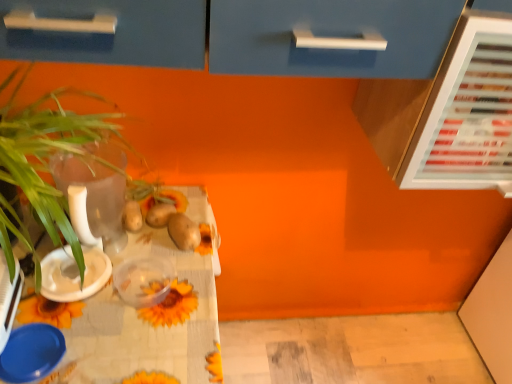
Describe the element at coordinates (174, 198) in the screenshot. This screenshot has width=512, height=384. I see `yellow matte flower at center` at that location.

This screenshot has height=384, width=512. Describe the element at coordinates (95, 196) in the screenshot. I see `transparent glass vase at left` at that location.

How much space does blue plastic lid at lower left, which is the 1th tableware in bottom-to-top order, occupy vertically?

blue plastic lid at lower left, which is the 1th tableware in bottom-to-top order, is 0.75 inches in height.

Identify the location of translucent plastic container at center, arranged as the 2th tableware when ordered from the bottom. The image size is (512, 384). (144, 280).

Find the location of `white plastic bowl at left, which is counted as the 3th tableware, starting from the bottom`. white plastic bowl at left, which is counted as the 3th tableware, starting from the bottom is located at coordinates (x=74, y=274).

Measure the distance between point (67,265) and camera.

The depth of point (67,265) is 36.65 inches.

Where is `yellow matte flower at center`? Image resolution: width=512 pixels, height=384 pixels. yellow matte flower at center is located at coordinates (174, 198).

Does green leafy plant at left turn towards translucent plastic container at center, arranged as the 2th tableware when ordered from the bottom?

No, green leafy plant at left is not facing towards translucent plastic container at center, arranged as the 2th tableware when ordered from the bottom.

Can you tell me how much green leafy plant at left and translucent plastic container at center, which is the second tableware from top to bottom, differ in facing direction?

There is a 4.38-degree angle between the facing directions of green leafy plant at left and translucent plastic container at center, which is the second tableware from top to bottom.

From a real-world perspective, starting from the green leafy plant at left, which tableware is the 2nd one below it? Please provide its 2D coordinates.

[(144, 280)]

Is point (1, 131) closer or farther from the camera than point (121, 281)?

Point (1, 131).

The image size is (512, 384). In order to click on tableware on the right of green leafy plant at left in this screenshot , I will do `click(144, 280)`.

Considering the sizes of objects translucent plastic container at center, which is the second tableware from top to bottom, and green leafy plant at left in the image provided, who is taller, translucent plastic container at center, which is the second tableware from top to bottom, or green leafy plant at left?

green leafy plant at left is taller.

From a real-world perspective, is translucent plastic container at center, arranged as the 2th tableware when ordered from the bottom, above or below green leafy plant at left?

translucent plastic container at center, arranged as the 2th tableware when ordered from the bottom, is situated lower than green leafy plant at left in the real world.

Who is bigger, green leafy plant at left or blue plastic bowl at lower left?

Bigger between the two is green leafy plant at left.

From the image's perspective, is green leafy plant at left above or below blue plastic bowl at lower left?

Clearly, from the image's perspective, green leafy plant at left is above blue plastic bowl at lower left.

Looking at this image, from a real-world perspective, is green leafy plant at left below blue plastic bowl at lower left?

No.

Could you tell me if yellow matte flower at center is facing translucent plastic container at center, arranged as the 2th tableware when ordered from the bottom?

No, yellow matte flower at center is not oriented towards translucent plastic container at center, arranged as the 2th tableware when ordered from the bottom.

Is yellow matte flower at center bigger than translucent plastic container at center, arranged as the 2th tableware when ordered from the bottom?

Incorrect, yellow matte flower at center is not larger than translucent plastic container at center, arranged as the 2th tableware when ordered from the bottom.

In the image, is yellow matte flower at center positioned in front of or behind translucent plastic container at center, arranged as the 2th tableware when ordered from the bottom?

Clearly, yellow matte flower at center is behind translucent plastic container at center, arranged as the 2th tableware when ordered from the bottom.

Based on the photo, from the image's perspective, is yellow matte flower at center located beneath translucent plastic container at center, which is the second tableware from top to bottom?

No.

Would you say yellow matte flower at center is outside sunflower-patterned tablecloth at lower left?

Indeed, yellow matte flower at center is completely outside sunflower-patterned tablecloth at lower left.

Would you consider yellow matte flower at center to be distant from sunflower-patterned tablecloth at lower left?

They are positioned close to each other.

From a real-world perspective, which object rests below the other?

In real-world perspective, sunflower-patterned tablecloth at lower left is lower.

Is green leafy plant at left far from transparent glass vase at left?

No, green leafy plant at left is not far away from transparent glass vase at left.

Is green leafy plant at left facing away from transparent glass vase at left?

That's right, green leafy plant at left is facing away from transparent glass vase at left.

Considering the points (81, 94) and (56, 178), which point is in front, point (81, 94) or point (56, 178)?

Positioned in front is point (81, 94).

Consider the image. Is translucent plastic container at center, which is the second tableware from top to bottom, taller than blue plastic lid at lower left, positioned as the 3th tableware in top-to-bottom order?

In fact, translucent plastic container at center, which is the second tableware from top to bottom, may be shorter than blue plastic lid at lower left, positioned as the 3th tableware in top-to-bottom order.

From a real-world perspective, which is physically above, translucent plastic container at center, arranged as the 2th tableware when ordered from the bottom, or blue plastic lid at lower left, positioned as the 3th tableware in top-to-bottom order?

translucent plastic container at center, arranged as the 2th tableware when ordered from the bottom.

Between translucent plastic container at center, arranged as the 2th tableware when ordered from the bottom, and blue plastic lid at lower left, which is the 1th tableware in bottom-to-top order, which one appears on the left side from the viewer's perspective?

From the viewer's perspective, blue plastic lid at lower left, which is the 1th tableware in bottom-to-top order, appears more on the left side.

At what (x,y) coordinates should I click in order to perform the action: click on tableware that is the 2nd object located below the green leafy plant at left (from the image's perspective). Please return your answer as a coordinate pair (x, y). Looking at the image, I should click on tap(144, 280).

What are the coordinates of `the 3rd tableware behind the green leafy plant at left, counting from the anchor's position` in the screenshot? It's located at (144, 280).

From the image, which object appears to be nearer to white plastic bowl at left, the first tableware from the top, blue plastic lid at lower left, positioned as the 3th tableware in top-to-bottom order, or sunflower-patterned tablecloth at lower left?

Based on the image, blue plastic lid at lower left, positioned as the 3th tableware in top-to-bottom order, appears to be nearer to white plastic bowl at left, the first tableware from the top.

When comparing their distances from translucent plastic container at center, which is the second tableware from top to bottom, does blue plastic lid at lower left, positioned as the 3th tableware in top-to-bottom order, or green leafy plant at left seem further?

green leafy plant at left is further to translucent plastic container at center, which is the second tableware from top to bottom.

Estimate the real-world distances between objects in this image. Which object is closer to green leafy plant at left, blue plastic lid at lower left, which is the 1th tableware in bottom-to-top order, or sunflower-patterned tablecloth at lower left?

sunflower-patterned tablecloth at lower left.

Which object lies nearer to the anchor point sunflower-patterned tablecloth at lower left, green leafy plant at left or yellow matte flower at center?

Based on the image, green leafy plant at left appears to be nearer to sunflower-patterned tablecloth at lower left.

Considering their positions, is yellow matte flower at center positioned closer to white plastic bowl at left, which is counted as the 3th tableware, starting from the bottom, than translucent plastic container at center, which is the second tableware from top to bottom?

translucent plastic container at center, which is the second tableware from top to bottom.

Considering their positions, is sunflower-patterned tablecloth at lower left positioned closer to white plastic bowl at left, the first tableware from the top, than blue plastic bowl at lower left?

The object closer to white plastic bowl at left, the first tableware from the top, is blue plastic bowl at lower left.

From the image, which object appears to be nearer to transparent glass vase at left, white plastic bowl at left, the first tableware from the top, or sunflower-patterned tablecloth at lower left?

white plastic bowl at left, the first tableware from the top, is positioned closer to the anchor transparent glass vase at left.

When comparing their distances from green leafy plant at left, does white plastic bowl at left, the first tableware from the top, or blue plastic lid at lower left, which is the 1th tableware in bottom-to-top order, seem further?

Among the two, blue plastic lid at lower left, which is the 1th tableware in bottom-to-top order, is located further to green leafy plant at left.

Where is `appliance located between green leafy plant at left and white plastic bowl at left, the first tableware from the top, in the depth direction`? The image size is (512, 384). appliance located between green leafy plant at left and white plastic bowl at left, the first tableware from the top, in the depth direction is located at coordinates (8, 298).

Locate an element on the screen. appliance between green leafy plant at left and yellow matte flower at center in the front-back direction is located at coordinates (8, 298).

Where is `appliance between green leafy plant at left and blue plastic lid at lower left, which is the 1th tableware in bottom-to-top order, from top to bottom`? This screenshot has height=384, width=512. appliance between green leafy plant at left and blue plastic lid at lower left, which is the 1th tableware in bottom-to-top order, from top to bottom is located at coordinates (8, 298).

You are a GUI agent. You are given a task and a screenshot of the screen. Output one action in this format:
    pyautogui.click(x=<x>, y=<y>)
    Task: Click on the glass vase that lies between green leafy plant at left and sunflower-patterned tablecloth at lower left from top to bottom
    
    Given the screenshot: What is the action you would take?
    pyautogui.click(x=95, y=196)